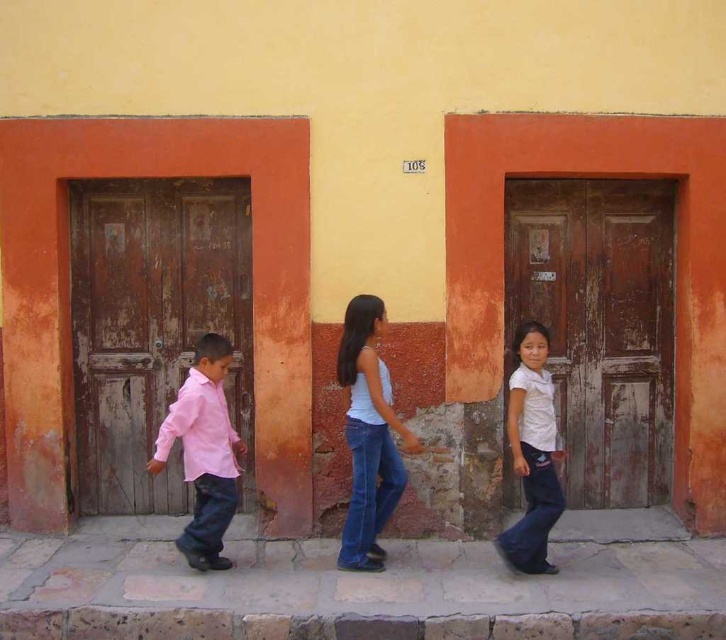
You are a delivery person carrying a package that requires a 3 meter clearance to pass through. You need to move the package from the wooden door at left to the white matte shirt at center. Is the distance sufficient?

The distance between the wooden door at left and the white matte shirt at center is 2.51 meters, which is less than the required 3 meters clearance. Therefore, the package cannot be moved through this path as it does not meet the clearance requirement.

You are a photographer trying to capture the children walking past the building. You want to ensure that the white matte tank top at center and the pink matte shirt at left are both visible in your photo. Based on their positions, which child should you focus on first to make sure both are in frame?

The white matte tank top at center is positioned over the pink matte shirt at left, so focusing on the child wearing the white matte tank top at center first will ensure both are visible as they overlap slightly.